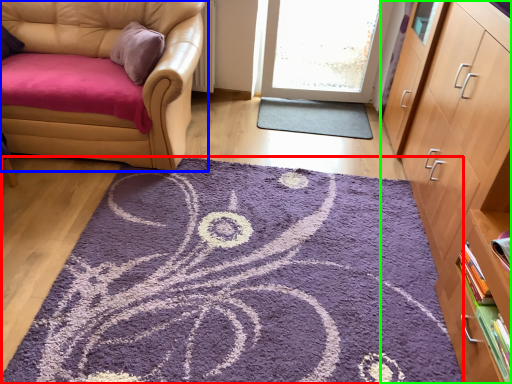
Question: Which is nearer to the mat (highlighted by a red box)? chair (highlighted by a blue box) or cabinetry (highlighted by a green box).

Choices:
 (A) chair
 (B) cabinetry

Answer: (B)